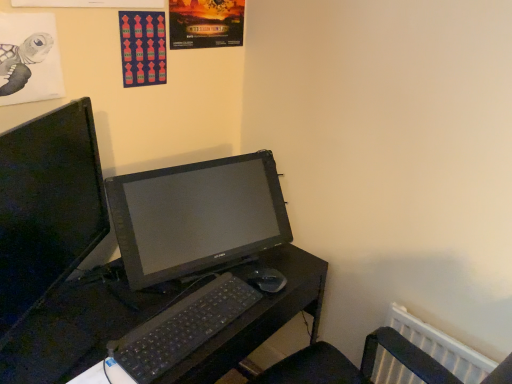
What is the approximate height of black plastic keyboard at center?

0.74 inches.

Where is `black plastic mouse at lower center`? This screenshot has width=512, height=384. black plastic mouse at lower center is located at coordinates (267, 280).

What is the approximate width of matte paper poster at upper center, marked as the 1th poster page in a right-to-left arrangement?

It is 1.83 centimeters.

What do you see at coordinates (29, 59) in the screenshot? The width and height of the screenshot is (512, 384). I see `matte paper turtle at upper left, which is counted as the 3th poster page, starting from the right` at bounding box center [29, 59].

The width and height of the screenshot is (512, 384). Describe the element at coordinates (79, 329) in the screenshot. I see `black plastic desk at center` at that location.

Locate an element on the screen. matte black monitor at left is located at coordinates (47, 208).

The width and height of the screenshot is (512, 384). I want to click on black plastic keyboard at center, so click(x=178, y=331).

Is red fabric poster at upper center, acting as the second poster page starting from the left, to the left or to the right of black plastic mouse at lower center in the image?

red fabric poster at upper center, acting as the second poster page starting from the left, is to the left of black plastic mouse at lower center.

Is point (128, 14) closer or farther from the camera than point (285, 279)?

Point (128, 14) is closer to the camera than point (285, 279).

From the image's perspective, is red fabric poster at upper center, placed as the second poster page when sorted from right to left, positioned above or below black plastic mouse at lower center?

Based on their image positions, red fabric poster at upper center, placed as the second poster page when sorted from right to left, is located above black plastic mouse at lower center.

In terms of height, does red fabric poster at upper center, acting as the second poster page starting from the left, look taller or shorter compared to black plastic mouse at lower center?

red fabric poster at upper center, acting as the second poster page starting from the left, is taller than black plastic mouse at lower center.

From the picture: Is matte black monitor at left at the back of black plastic keyboard at center?

No, black plastic keyboard at center's orientation is not away from matte black monitor at left.

Between black plastic keyboard at center and matte black monitor at left, which one appears on the right side from the viewer's perspective?

Positioned to the right is black plastic keyboard at center.

From a real-world perspective, is black plastic keyboard at center physically below matte black monitor at left?

Yes, from a real-world perspective, black plastic keyboard at center is below matte black monitor at left.

Can you confirm if black plastic keyboard at center is bigger than matte paper turtle at upper left, which is counted as the 3th poster page, starting from the right?

Yes.

Is black plastic keyboard at center positioned beyond the bounds of matte paper turtle at upper left, which appears as the 1th poster page when viewed from the left?

Yes, black plastic keyboard at center is outside of matte paper turtle at upper left, which appears as the 1th poster page when viewed from the left.

Consider the image. Is black plastic keyboard at center far away from matte paper turtle at upper left, which is counted as the 3th poster page, starting from the right?

Actually, black plastic keyboard at center and matte paper turtle at upper left, which is counted as the 3th poster page, starting from the right, are a little close together.

Which object is closer to the camera taking this photo, black plastic keyboard at center or matte paper turtle at upper left, which appears as the 1th poster page when viewed from the left?

matte paper turtle at upper left, which appears as the 1th poster page when viewed from the left, is more forward.

The width and height of the screenshot is (512, 384). Identify the location of computer monitor below the red fabric poster at upper center, acting as the second poster page starting from the left (from the image's perspective). (x=47, y=208).

Considering the sizes of objects matte black monitor at left and red fabric poster at upper center, placed as the second poster page when sorted from right to left, in the image provided, who is shorter, matte black monitor at left or red fabric poster at upper center, placed as the second poster page when sorted from right to left,?

With less height is red fabric poster at upper center, placed as the second poster page when sorted from right to left.

Is matte black monitor at left not inside red fabric poster at upper center, acting as the second poster page starting from the left?

Yes, matte black monitor at left is located beyond the bounds of red fabric poster at upper center, acting as the second poster page starting from the left.

Based on their positions, is matte black monitor at left located to the left or right of red fabric poster at upper center, placed as the second poster page when sorted from right to left?

matte black monitor at left is positioned on red fabric poster at upper center, placed as the second poster page when sorted from right to left,'s left side.

Considering the sizes of objects matte paper poster at upper center, positioned as the third poster page in left-to-right order, and black plastic desk at center in the image provided, who is thinner, matte paper poster at upper center, positioned as the third poster page in left-to-right order, or black plastic desk at center?

matte paper poster at upper center, positioned as the third poster page in left-to-right order.

Is point (209, 40) closer or farther from the camera than point (236, 296)?

Point (209, 40) is farther from the camera than point (236, 296).

Consider the image. Which of these two, matte paper poster at upper center, marked as the 1th poster page in a right-to-left arrangement, or black plastic desk at center, stands taller?

black plastic desk at center is taller.

I want to click on poster page that is on the right side of black plastic desk at center, so click(x=205, y=23).

Locate an element on the screen. The width and height of the screenshot is (512, 384). computer keyboard behind the matte black monitor at left is located at coordinates (178, 331).

Does matte black monitor at left have a greater width compared to black plastic keyboard at center?

Yes.

From the image's perspective, who appears lower, matte black monitor at left or black plastic keyboard at center?

black plastic keyboard at center is shown below in the image.

Who is shorter, matte black monitor at left or black plastic keyboard at center?

black plastic keyboard at center.

Is point (42, 324) closer to camera compared to point (92, 219)?

Yes, point (42, 324) is in front of point (92, 219).

Between black plastic desk at center and matte black monitor at left, which one has less height?

matte black monitor at left.

Does black plastic desk at center touch matte black monitor at left?

They are not placed beside each other.

From the picture: How distant is black plastic desk at center from matte black monitor at left?

black plastic desk at center and matte black monitor at left are 32.75 centimeters apart from each other.

Which poster page is the 2nd one when counting from the left side of the black plastic mouse at lower center? Please provide its 2D coordinates.

[(143, 47)]

Image resolution: width=512 pixels, height=384 pixels. I want to click on computer monitor in front of the black plastic keyboard at center, so click(x=47, y=208).

When comparing their distances from black plastic desk at center, does black plastic mouse at lower center or red fabric poster at upper center, acting as the second poster page starting from the left, seem further?

red fabric poster at upper center, acting as the second poster page starting from the left.

Which object lies nearer to the anchor point matte paper turtle at upper left, which appears as the 1th poster page when viewed from the left, black plastic mouse at lower center or matte paper poster at upper center, marked as the 1th poster page in a right-to-left arrangement?

The object closer to matte paper turtle at upper left, which appears as the 1th poster page when viewed from the left, is matte paper poster at upper center, marked as the 1th poster page in a right-to-left arrangement.

Estimate the real-world distances between objects in this image. Which object is further from matte paper turtle at upper left, which appears as the 1th poster page when viewed from the left, black plastic desk at center or matte black monitor at left?

Among the two, black plastic desk at center is located further to matte paper turtle at upper left, which appears as the 1th poster page when viewed from the left.

Which object lies nearer to the anchor point red fabric poster at upper center, acting as the second poster page starting from the left, matte black monitor at left or black plastic keyboard at center?

Based on the image, matte black monitor at left appears to be nearer to red fabric poster at upper center, acting as the second poster page starting from the left.

Estimate the real-world distances between objects in this image. Which object is further from matte paper poster at upper center, marked as the 1th poster page in a right-to-left arrangement, black plastic mouse at lower center or black plastic desk at center?

Among the two, black plastic desk at center is located further to matte paper poster at upper center, marked as the 1th poster page in a right-to-left arrangement.

Considering their positions, is black plastic mouse at lower center positioned further to matte black monitor at left than matte paper poster at upper center, marked as the 1th poster page in a right-to-left arrangement?

matte paper poster at upper center, marked as the 1th poster page in a right-to-left arrangement.

Looking at the image, which one is located closer to matte paper turtle at upper left, which is counted as the 3th poster page, starting from the right, black plastic mouse at lower center or black plastic keyboard at center?

Among the two, black plastic keyboard at center is located nearer to matte paper turtle at upper left, which is counted as the 3th poster page, starting from the right.

When comparing their distances from black plastic keyboard at center, does red fabric poster at upper center, placed as the second poster page when sorted from right to left, or matte paper turtle at upper left, which appears as the 1th poster page when viewed from the left, seem further?

red fabric poster at upper center, placed as the second poster page when sorted from right to left, is further to black plastic keyboard at center.

This screenshot has height=384, width=512. Find the location of `computer keyboard between red fabric poster at upper center, placed as the second poster page when sorted from right to left, and black plastic desk at center in the up-down direction`. computer keyboard between red fabric poster at upper center, placed as the second poster page when sorted from right to left, and black plastic desk at center in the up-down direction is located at coordinates (178, 331).

Where is `poster page between red fabric poster at upper center, placed as the second poster page when sorted from right to left, and black plastic keyboard at center in the up-down direction`? poster page between red fabric poster at upper center, placed as the second poster page when sorted from right to left, and black plastic keyboard at center in the up-down direction is located at coordinates (29, 59).

The image size is (512, 384). I want to click on poster page between red fabric poster at upper center, placed as the second poster page when sorted from right to left, and black plastic desk at center in the up-down direction, so click(29, 59).

Locate an element on the screen. This screenshot has width=512, height=384. computer monitor between matte paper poster at upper center, positioned as the third poster page in left-to-right order, and black plastic mouse at lower center from top to bottom is located at coordinates (47, 208).